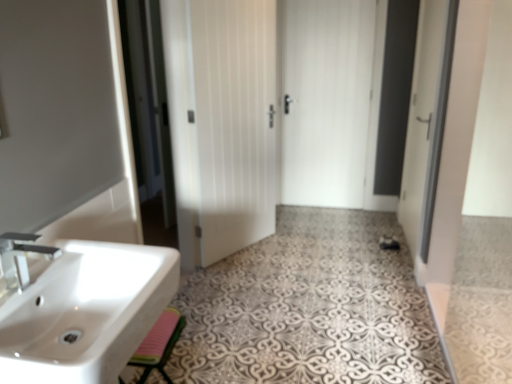
This screenshot has width=512, height=384. What do you see at coordinates (159, 344) in the screenshot? I see `pink rubber mat at lower left` at bounding box center [159, 344].

Measure the distance between point (148, 149) and camera.

A distance of 3.92 meters exists between point (148, 149) and camera.

This screenshot has height=384, width=512. Describe the element at coordinates (310, 308) in the screenshot. I see `white glossy towel at lower left` at that location.

Describe the element at coordinates (426, 121) in the screenshot. This screenshot has height=384, width=512. I see `white glossy door at right, acting as the 1th screen door starting from the front` at that location.

Image resolution: width=512 pixels, height=384 pixels. What do you see at coordinates (234, 121) in the screenshot?
I see `white matte door at center, positioned as the 1th door in left-to-right order` at bounding box center [234, 121].

The height and width of the screenshot is (384, 512). What are the coordinates of `pink rubber mat at lower left` in the screenshot? It's located at (159, 344).

Where is `the 2nd screen door behind the white glossy sink at lower left, starting your count from the anchor`? This screenshot has height=384, width=512. the 2nd screen door behind the white glossy sink at lower left, starting your count from the anchor is located at coordinates (149, 118).

Could you tell me if white glossy sink at lower left is facing transparent glass screen door at center, the first screen door when ordered from left to right?

No.

How many degrees apart are the facing directions of white glossy sink at lower left and transparent glass screen door at center, which is the 2th screen door in right-to-left order?

There is a 93.2-degree angle between the facing directions of white glossy sink at lower left and transparent glass screen door at center, which is the 2th screen door in right-to-left order.

Considering the sizes of objects white glossy sink at lower left and transparent glass screen door at center, which appears as the second screen door when viewed from the front, in the image provided, who is wider, white glossy sink at lower left or transparent glass screen door at center, which appears as the second screen door when viewed from the front,?

white glossy sink at lower left.

From a real-world perspective, who is located lower, white matte door at center, marked as the first door in a front-to-back arrangement, or matte silver faucet at left?

From a 3D spatial view, white matte door at center, marked as the first door in a front-to-back arrangement, is below.

Is white matte door at center, marked as the first door in a front-to-back arrangement, in front of or behind matte silver faucet at left in the image?

white matte door at center, marked as the first door in a front-to-back arrangement, is behind matte silver faucet at left.

From the matte silver faucet at left, count 1st doors backward and point to it. Please provide its 2D coordinates.

[(234, 121)]

Consider the image. From the image's perspective, between white matte door at center, marked as the first door in a front-to-back arrangement, and matte silver faucet at left, who is located below?

matte silver faucet at left appears lower in the image.

Does transparent glass screen door at center, acting as the 1th screen door starting from the back, have a greater width compared to white glossy sink at lower left?

Incorrect, the width of transparent glass screen door at center, acting as the 1th screen door starting from the back, does not surpass that of white glossy sink at lower left.

Where is `screen door on the left of white glossy sink at lower left`? The width and height of the screenshot is (512, 384). screen door on the left of white glossy sink at lower left is located at coordinates point(149,118).

Who is shorter, transparent glass screen door at center, which appears as the second screen door when viewed from the front, or white glossy towel at lower left?

With less height is white glossy towel at lower left.

Consider the image. From the image's perspective, between transparent glass screen door at center, which appears as the second screen door when viewed from the front, and white glossy towel at lower left, which one is located above?

transparent glass screen door at center, which appears as the second screen door when viewed from the front.

Consider the image. Relative to white glossy towel at lower left, is transparent glass screen door at center, acting as the 1th screen door starting from the back, in front or behind?

Clearly, transparent glass screen door at center, acting as the 1th screen door starting from the back, is behind white glossy towel at lower left.

Where is `tap on the left of white glossy towel at lower left`? tap on the left of white glossy towel at lower left is located at coordinates (22, 257).

Considering the positions of point (203, 276) and point (24, 236), is point (203, 276) closer or farther from the camera than point (24, 236)?

Point (203, 276) is farther from the camera than point (24, 236).

How different are the orientations of white glossy towel at lower left and matte silver faucet at left in degrees?

There is a 180-degree angle between the facing directions of white glossy towel at lower left and matte silver faucet at left.

Considering the relative positions of white glossy towel at lower left and matte silver faucet at left in the image provided, is white glossy towel at lower left to the left of matte silver faucet at left from the viewer's perspective?

No, white glossy towel at lower left is not to the left of matte silver faucet at left.

Considering the sizes of objects matte silver faucet at left and white glossy towel at lower left in the image provided, who is smaller, matte silver faucet at left or white glossy towel at lower left?

matte silver faucet at left.

Visually, is matte silver faucet at left positioned to the left or to the right of white glossy towel at lower left?

In the image, matte silver faucet at left appears on the left side of white glossy towel at lower left.

I want to click on pattern below the matte silver faucet at left (from a real-world perspective), so click(310, 308).

What's the angular difference between matte silver faucet at left and white glossy towel at lower left's facing directions?

The angular difference between matte silver faucet at left and white glossy towel at lower left is 180 degrees.

Is white matte door at center, the 2th door in the left-to-right sequence, positioned in front of pink rubber mat at lower left?

No, white matte door at center, the 2th door in the left-to-right sequence, is behind pink rubber mat at lower left.

In the image, is white matte door at center, the 2th door in the left-to-right sequence, on the left side or the right side of pink rubber mat at lower left?

Based on their positions, white matte door at center, the 2th door in the left-to-right sequence, is located to the right of pink rubber mat at lower left.

From the image's perspective, would you say white matte door at center, the first door viewed from the back, is shown under pink rubber mat at lower left?

No, from the image's perspective, white matte door at center, the first door viewed from the back, is not beneath pink rubber mat at lower left.

Consider the image. Measure the distance between white matte door at center, the 2th door in the left-to-right sequence, and pink rubber mat at lower left.

The distance of white matte door at center, the 2th door in the left-to-right sequence, from pink rubber mat at lower left is 2.52 meters.

Locate an element on the screen. screen door on the left of white glossy sink at lower left is located at coordinates (149, 118).

Find the location of `tap in front of the white matte door at center, positioned as the 1th door in left-to-right order`. tap in front of the white matte door at center, positioned as the 1th door in left-to-right order is located at coordinates (22, 257).

From the image, which object appears to be nearer to white matte door at center, positioned as the 1th door in left-to-right order, matte silver faucet at left or transparent glass screen door at center, which appears as the second screen door when viewed from the front?

transparent glass screen door at center, which appears as the second screen door when viewed from the front, is closer to white matte door at center, positioned as the 1th door in left-to-right order.

When comparing their distances from white matte door at center, the first door viewed from the back, does pink rubber mat at lower left or transparent glass screen door at center, which appears as the second screen door when viewed from the front, seem further?

pink rubber mat at lower left is further to white matte door at center, the first door viewed from the back.

From the image, which object appears to be nearer to white glossy towel at lower left, white glossy sink at lower left or white matte door at center, the 2th door in the front-to-back sequence?

white glossy sink at lower left lies closer to white glossy towel at lower left than the other object.

Looking at the image, which one is located closer to white glossy towel at lower left, pink rubber mat at lower left or white glossy door at right, acting as the 1th screen door starting from the front?

pink rubber mat at lower left lies closer to white glossy towel at lower left than the other object.

Looking at the image, which one is located closer to white glossy door at right, arranged as the 2th screen door when viewed from the left, white matte door at center, the 2th door from the back, or matte silver faucet at left?

white matte door at center, the 2th door from the back, is positioned closer to the anchor white glossy door at right, arranged as the 2th screen door when viewed from the left.

Looking at the image, which one is located further to transparent glass screen door at center, which appears as the second screen door when viewed from the front, white matte door at center, the 2th door in the front-to-back sequence, or white glossy sink at lower left?

Among the two, white glossy sink at lower left is located further to transparent glass screen door at center, which appears as the second screen door when viewed from the front.

Which object lies nearer to the anchor point matte silver faucet at left, white glossy towel at lower left or white glossy door at right, acting as the 1th screen door starting from the front?

white glossy towel at lower left is positioned closer to the anchor matte silver faucet at left.

Based on their spatial positions, is transparent glass screen door at center, the first screen door when ordered from left to right, or pink rubber mat at lower left further from white glossy sink at lower left?

The object further to white glossy sink at lower left is transparent glass screen door at center, the first screen door when ordered from left to right.

At what (x,y) coordinates should I click in order to perform the action: click on sink between matte silver faucet at left and white glossy towel at lower left in the horizontal direction. Please return your answer as a coordinate pair (x, y). The image size is (512, 384). Looking at the image, I should click on (86, 313).

At what (x,y) coordinates should I click in order to perform the action: click on pattern located between white glossy sink at lower left and white glossy door at right, marked as the first screen door in a right-to-left arrangement, in the left-right direction. Please return your answer as a coordinate pair (x, y). Looking at the image, I should click on (310, 308).

Find the location of a particular element. The width and height of the screenshot is (512, 384). tap between white glossy sink at lower left and pink rubber mat at lower left along the z-axis is located at coordinates click(22, 257).

Find the location of a particular element. This screenshot has width=512, height=384. screen door positioned between pink rubber mat at lower left and white matte door at center, the 2th door in the left-to-right sequence, from near to far is located at coordinates (426, 121).